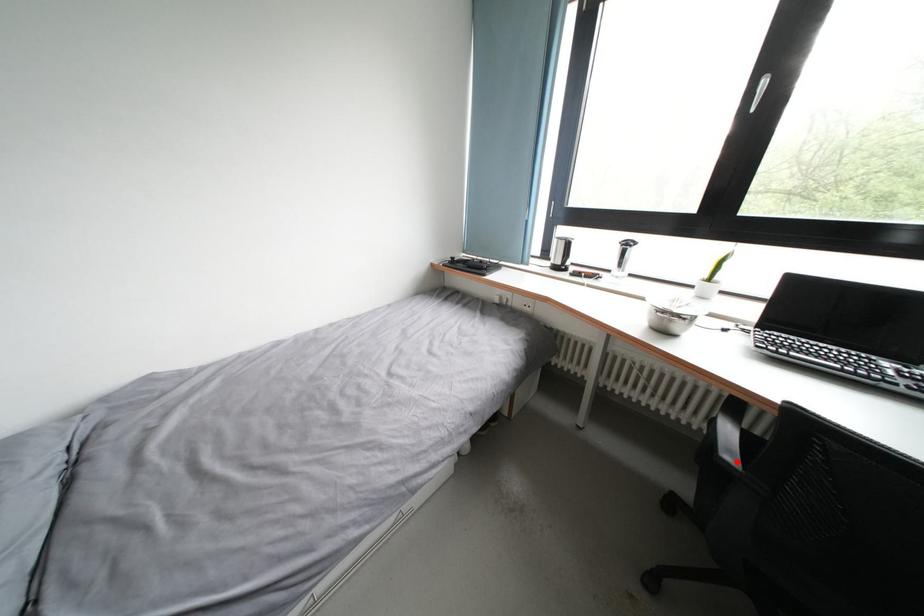
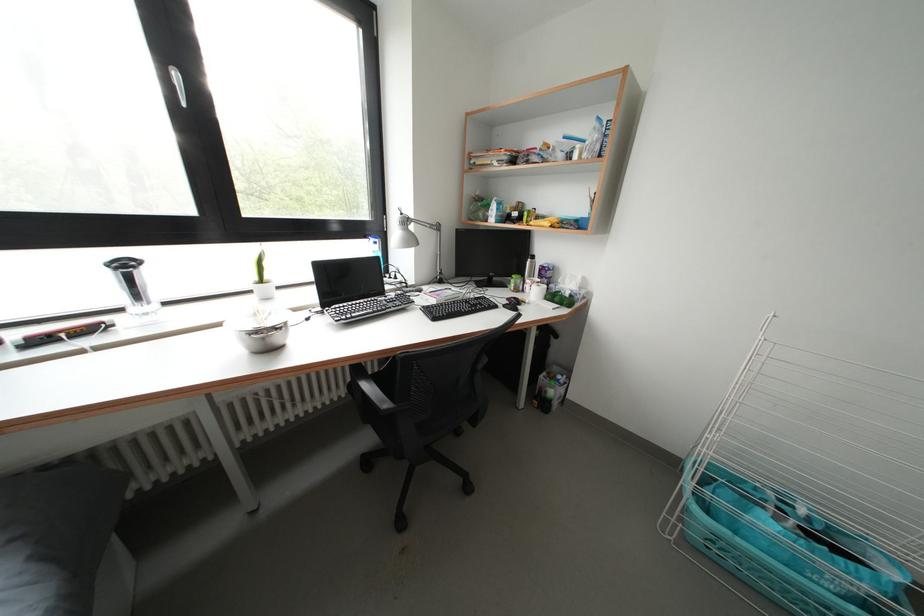
Question: I am providing you with two images of the same scene from different viewpoints. Image1 has a red point marked. In image2, the corresponding 3D location appears at what relative position? Reply with the corresponding letter.

Choices:
 (A) Closer
 (B) Farther

Answer: (A)